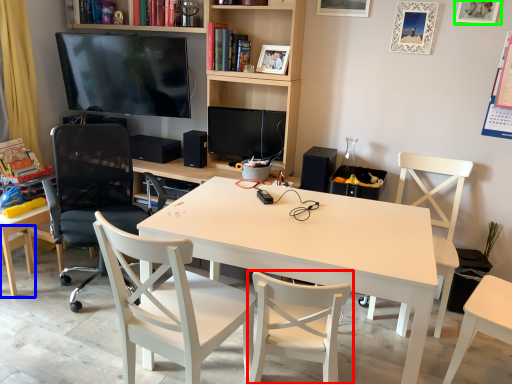
Question: Which object is the closest to the chair (highlighted by a red box)? Choose among these: chair (highlighted by a blue box) or picture frame (highlighted by a green box).

Choices:
 (A) chair
 (B) picture frame

Answer: (A)